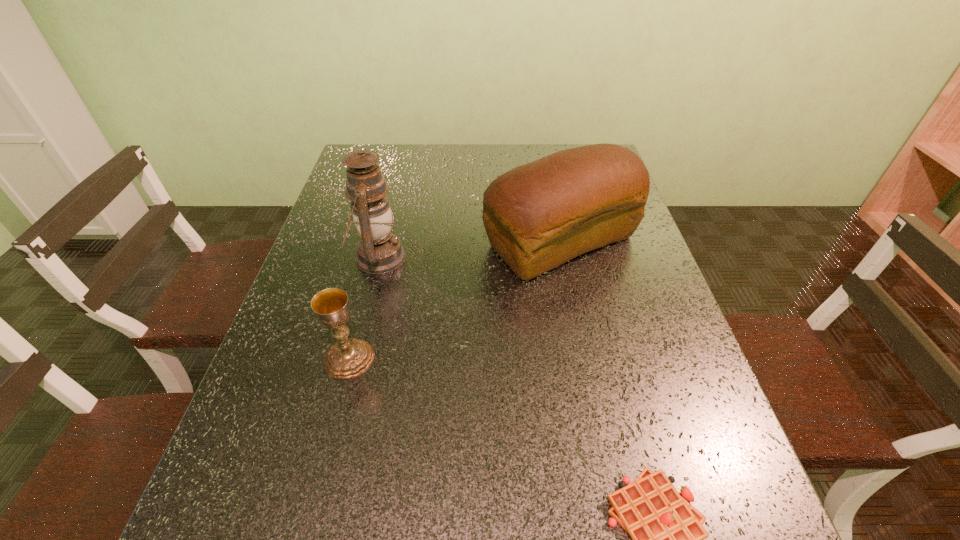
Locate an element on the screen. The width and height of the screenshot is (960, 540). the closest object to the waffle is located at coordinates (537, 216).

Locate which object is the third closest to the waffle. Please provide its 2D coordinates. Your answer should be formatted as a tuple, i.e. [(x, y)], where the tuple contains the x and y coordinates of a point satisfying the conditions above.

[(379, 251)]

Find the location of `free space that satisfies the following two spatial constraints: 1. on the back side of the chalice; 2. on the left side of the oil lamp`. free space that satisfies the following two spatial constraints: 1. on the back side of the chalice; 2. on the left side of the oil lamp is located at coordinates (375, 258).